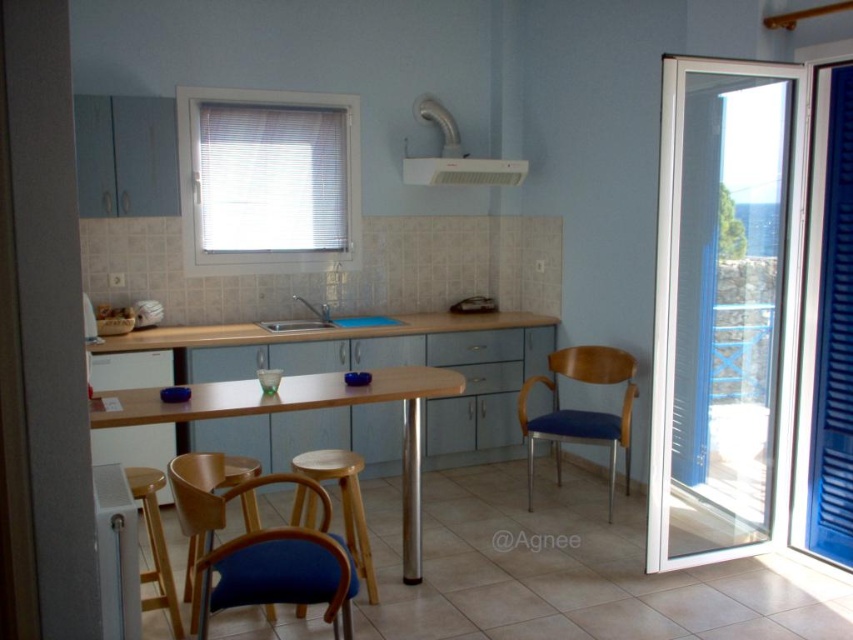
Question: Which point is closer to the camera taking this photo?

Choices:
 (A) (354, 579)
 (B) (409, 545)

Answer: (A)

Question: Is blue fabric chair at lower center thinner than wooden table at center?

Choices:
 (A) no
 (B) yes

Answer: (B)

Question: Which of these objects is positioned farthest from the transparent glass door at right?

Choices:
 (A) matte stainless steel sink at center
 (B) blue fabric chair at center
 (C) blue fabric stool at lower center

Answer: (A)

Question: Which object is the closest to the blue fabric chair at center?

Choices:
 (A) blue fabric stool at lower center
 (B) wooden table at center
 (C) transparent glass door at right

Answer: (C)

Question: Is wooden table at center closer to the viewer compared to matte stainless steel sink at center?

Choices:
 (A) no
 (B) yes

Answer: (B)

Question: Can you confirm if blue fabric chair at center is wider than matte stainless steel sink at center?

Choices:
 (A) yes
 (B) no

Answer: (A)